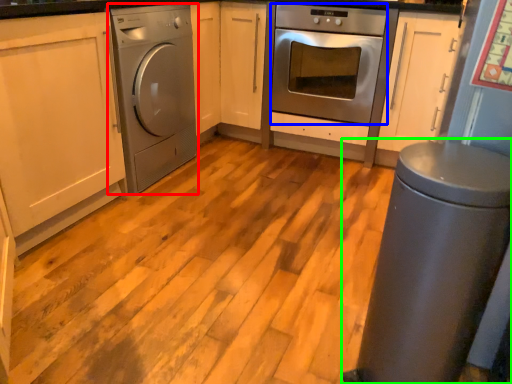
Question: Which object is the closest to the home appliance (highlighted by a red box)? Choose among these: oven (highlighted by a blue box) or gray (highlighted by a green box).

Choices:
 (A) oven
 (B) gray

Answer: (A)